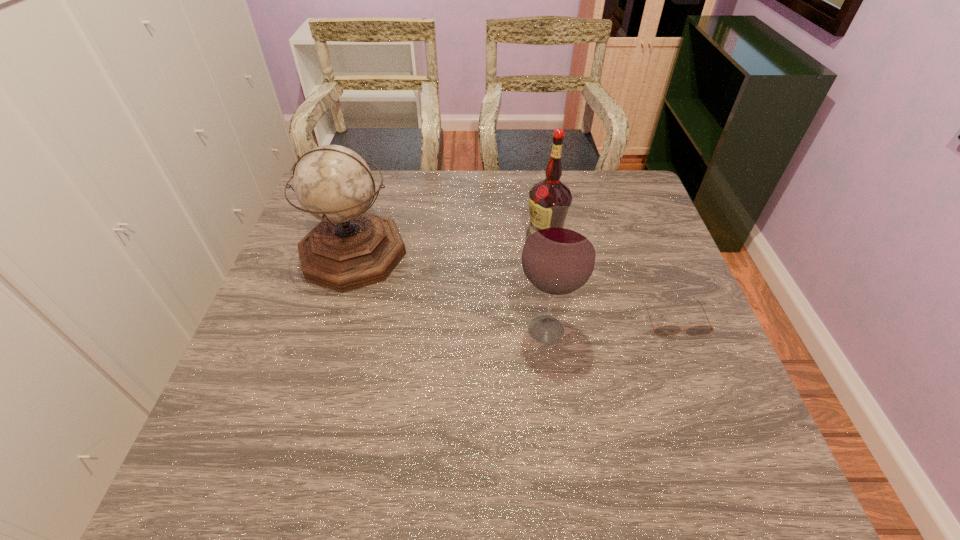
Find the location of a particular element. free area in between the globe and the shortest object is located at coordinates (514, 286).

Find the location of a particular element. Image resolution: width=960 pixels, height=540 pixels. free space between the rightmost object and the nearer alcohol is located at coordinates (611, 325).

Locate an element on the screen. The image size is (960, 540). free space between the globe and the nearer alcohol is located at coordinates (449, 292).

Image resolution: width=960 pixels, height=540 pixels. Find the location of `free point between the nearer alcohol and the rightmost object`. free point between the nearer alcohol and the rightmost object is located at coordinates (611, 325).

Image resolution: width=960 pixels, height=540 pixels. In order to click on free space between the globe and the nearer alcohol in this screenshot , I will do `click(449, 292)`.

Where is `vacant area that lies between the globe and the farther alcohol`? The width and height of the screenshot is (960, 540). vacant area that lies between the globe and the farther alcohol is located at coordinates (449, 246).

Where is `free space between the farther alcohol and the shortest object`? free space between the farther alcohol and the shortest object is located at coordinates (610, 279).

Locate an element on the screen. free spot between the leftmost object and the farther alcohol is located at coordinates point(449,246).

Select which object appears as the second closest to the globe. Please provide its 2D coordinates. Your answer should be formatted as a tuple, i.e. [(x, y)], where the tuple contains the x and y coordinates of a point satisfying the conditions above.

[(550, 192)]

Select which object appears as the second closest to the farther alcohol. Please provide its 2D coordinates. Your answer should be formatted as a tuple, i.e. [(x, y)], where the tuple contains the x and y coordinates of a point satisfying the conditions above.

[(666, 330)]